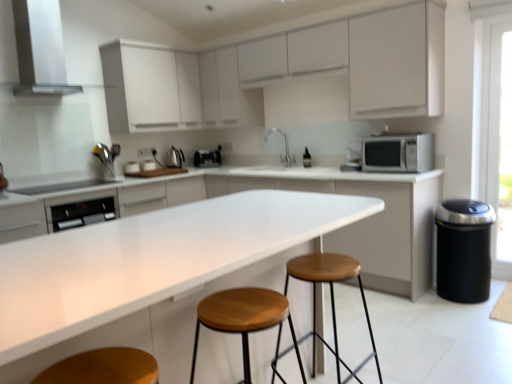
Question: Can you confirm if silver metallic microwave at right is bigger than satin black toaster at center, placed as the 1th appliance when sorted from back to front?

Choices:
 (A) no
 (B) yes

Answer: (B)

Question: Are silver metallic microwave at right and satin black toaster at center, the fourth appliance viewed from the front, making contact?

Choices:
 (A) yes
 (B) no

Answer: (B)

Question: Is silver metallic microwave at right outside satin black toaster at center, the 3th appliance in the left-to-right sequence?

Choices:
 (A) no
 (B) yes

Answer: (B)

Question: Could you tell me if silver metallic microwave at right is facing satin black toaster at center, which is the second appliance from right to left?

Choices:
 (A) yes
 (B) no

Answer: (B)

Question: From the image's perspective, would you say silver metallic microwave at right is positioned over satin black toaster at center, which is the first appliance from top to bottom?

Choices:
 (A) yes
 (B) no

Answer: (B)

Question: From a real-world perspective, is white glossy toaster at upper center, which is counted as the 3th appliance, starting from the top, physically located above or below satin nickel faucet at center?

Choices:
 (A) above
 (B) below

Answer: (B)

Question: Would you say white glossy toaster at upper center, the second appliance ordered from the bottom, is inside or outside satin nickel faucet at center?

Choices:
 (A) outside
 (B) inside

Answer: (A)

Question: From the image's perspective, relative to satin nickel faucet at center, is white glossy toaster at upper center, the second appliance ordered from the bottom, above or below?

Choices:
 (A) below
 (B) above

Answer: (A)

Question: From their relative heights in the image, would you say white glossy toaster at upper center, the 4th appliance when ordered from right to left, is taller or shorter than satin nickel faucet at center?

Choices:
 (A) tall
 (B) short

Answer: (B)

Question: From a real-world perspective, is white glossy toaster at upper center, the 4th appliance when ordered from right to left, positioned above or below satin black toaster at center, which is the second appliance from right to left?

Choices:
 (A) below
 (B) above

Answer: (A)

Question: From the image's perspective, relative to satin black toaster at center, placed as the 1th appliance when sorted from back to front, is white glossy toaster at upper center, which is counted as the 3th appliance, starting from the top, above or below?

Choices:
 (A) above
 (B) below

Answer: (B)

Question: Is white glossy toaster at upper center, the 4th appliance when ordered from right to left, bigger or smaller than satin black toaster at center, which is the first appliance from top to bottom?

Choices:
 (A) big
 (B) small

Answer: (B)

Question: Relative to satin black toaster at center, which is the second appliance from right to left, is white glossy toaster at upper center, which appears as the 1th appliance when viewed from the left, in front or behind?

Choices:
 (A) front
 (B) behind

Answer: (A)

Question: Considering the positions of point (211, 162) and point (132, 172), is point (211, 162) closer or farther from the camera than point (132, 172)?

Choices:
 (A) closer
 (B) farther

Answer: (B)

Question: Is satin black toaster at center, which is the second appliance from right to left, in front of or behind white glossy toaster at upper center, the second appliance from the front, in the image?

Choices:
 (A) front
 (B) behind

Answer: (B)